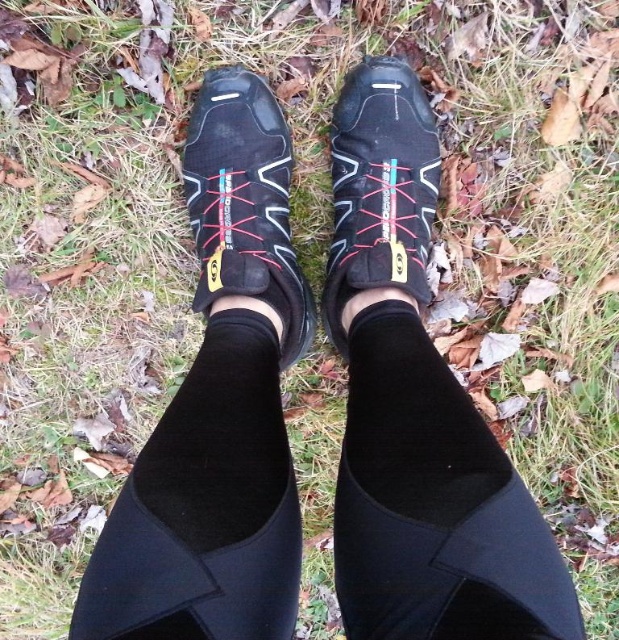
Question: Which point is closer to the camera?

Choices:
 (A) black smooth sock at center
 (B) black mesh shoe at center
 (C) matte black shoe at center

Answer: (A)

Question: Can you confirm if black spandex sock at center is positioned below matte black shoe at center?

Choices:
 (A) yes
 (B) no

Answer: (A)

Question: Which object appears farthest from the camera in this image?

Choices:
 (A) black mesh shoe at center
 (B) black smooth sock at center
 (C) black spandex sock at center

Answer: (A)

Question: Among these points, which one is farthest from the camera?

Choices:
 (A) (386, 122)
 (B) (361, 323)

Answer: (A)

Question: Observing the image, what is the correct spatial positioning of black smooth sock at center in reference to black spandex sock at center?

Choices:
 (A) left
 (B) right

Answer: (B)

Question: Is black spandex sock at center to the right of black mesh shoe at center from the viewer's perspective?

Choices:
 (A) no
 (B) yes

Answer: (B)